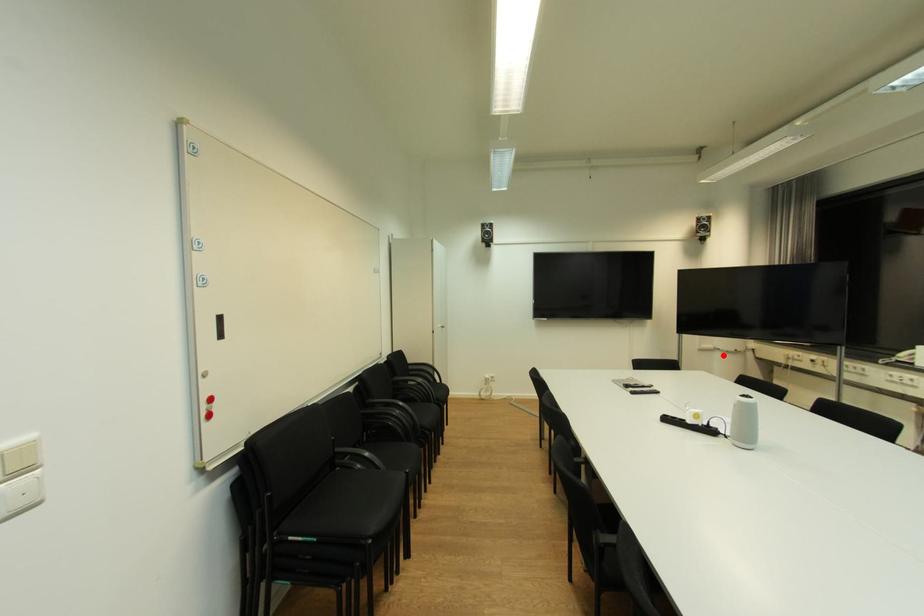
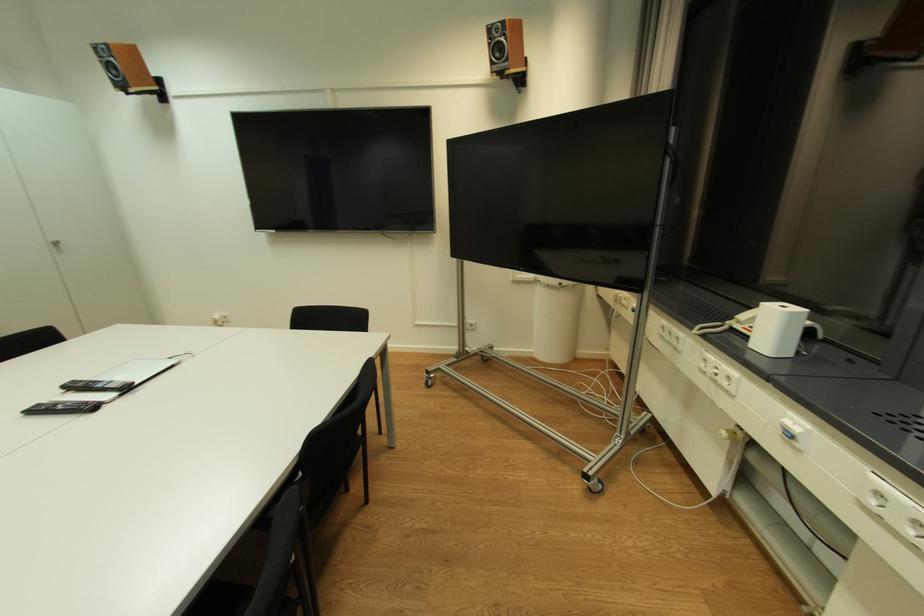
Where in the second image is the point corresponding to the highlighted location from the first image?

(544, 290)